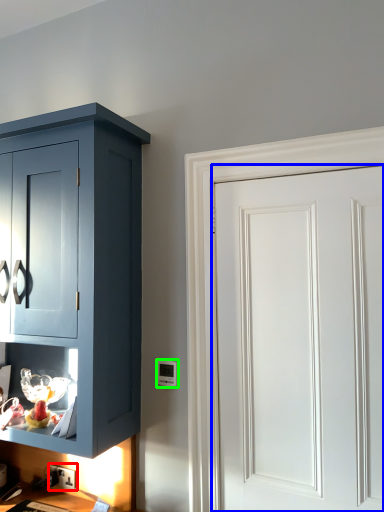
Question: Considering the real-world distances, which object is closest to electric outlet (highlighted by a red box)? door (highlighted by a blue box) or light switch (highlighted by a green box).

Choices:
 (A) door
 (B) light switch

Answer: (B)